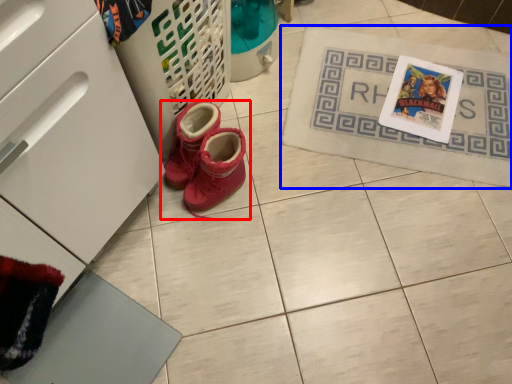
Question: Which of the following is the farthest to the observer, footwear (highlighted by a red box) or bath mat (highlighted by a blue box)?

Choices:
 (A) footwear
 (B) bath mat

Answer: (B)